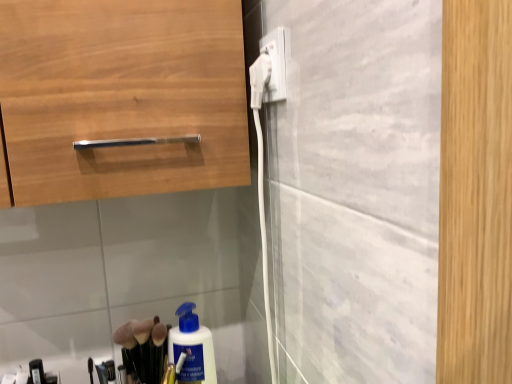
Question: Is white plastic plug at upper center, which is the second electric outlet from left to right, to the right of white plastic plug at upper center, marked as the first electric outlet in a left-to-right arrangement, from the viewer's perspective?

Choices:
 (A) no
 (B) yes

Answer: (B)

Question: Does white plastic plug at upper center, which is the second electric outlet from left to right, have a smaller size compared to white plastic plug at upper center, marked as the first electric outlet in a left-to-right arrangement?

Choices:
 (A) no
 (B) yes

Answer: (A)

Question: Is white plastic plug at upper center, the first electric outlet when ordered from right to left, far away from white plastic plug at upper center, marked as the first electric outlet in a left-to-right arrangement?

Choices:
 (A) no
 (B) yes

Answer: (A)

Question: Is white plastic plug at upper center, which is the second electric outlet from left to right, thinner than white plastic plug at upper center, placed as the 2th electric outlet when sorted from right to left?

Choices:
 (A) no
 (B) yes

Answer: (A)

Question: Considering the relative sizes of white plastic plug at upper center, the first electric outlet when ordered from right to left, and white plastic plug at upper center, marked as the first electric outlet in a left-to-right arrangement, in the image provided, is white plastic plug at upper center, the first electric outlet when ordered from right to left, shorter than white plastic plug at upper center, marked as the first electric outlet in a left-to-right arrangement,?

Choices:
 (A) yes
 (B) no

Answer: (B)

Question: Does white plastic plug at upper center, which is the second electric outlet from left to right, come in front of white plastic plug at upper center, marked as the first electric outlet in a left-to-right arrangement?

Choices:
 (A) yes
 (B) no

Answer: (A)

Question: Does white plastic plug at upper center, placed as the 2th electric outlet when sorted from right to left, appear on the left side of white plastic plug at upper center, which is the second electric outlet from left to right?

Choices:
 (A) yes
 (B) no

Answer: (A)

Question: From the image's perspective, is white plastic plug at upper center, marked as the first electric outlet in a left-to-right arrangement, below white plastic plug at upper center, the first electric outlet when ordered from right to left?

Choices:
 (A) yes
 (B) no

Answer: (A)

Question: Can you confirm if white plastic plug at upper center, placed as the 2th electric outlet when sorted from right to left, is wider than white plastic plug at upper center, which is the second electric outlet from left to right?

Choices:
 (A) yes
 (B) no

Answer: (B)

Question: Is white plastic plug at upper center, marked as the first electric outlet in a left-to-right arrangement, oriented away from white plastic plug at upper center, which is the second electric outlet from left to right?

Choices:
 (A) no
 (B) yes

Answer: (A)

Question: Is white plastic plug at upper center, placed as the 2th electric outlet when sorted from right to left, not near white plastic plug at upper center, the first electric outlet when ordered from right to left?

Choices:
 (A) yes
 (B) no

Answer: (B)

Question: Are white plastic plug at upper center, marked as the first electric outlet in a left-to-right arrangement, and white plastic plug at upper center, which is the second electric outlet from left to right, making contact?

Choices:
 (A) no
 (B) yes

Answer: (B)

Question: In terms of size, does white plastic plug at upper center, placed as the 2th electric outlet when sorted from right to left, appear bigger or smaller than white plastic plug at upper center, the first electric outlet when ordered from right to left?

Choices:
 (A) small
 (B) big

Answer: (A)